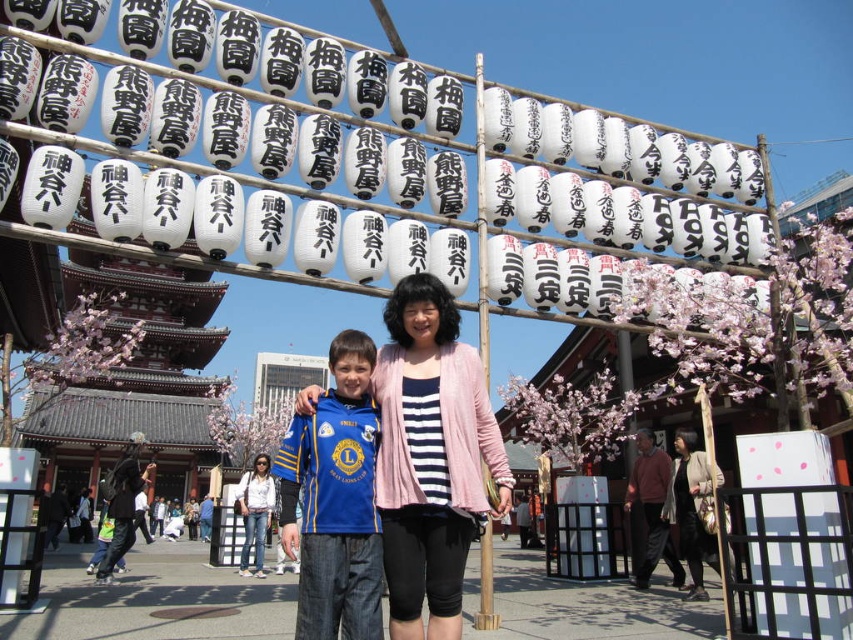
You are a photographer at the festival and want to ensure both jackets are visible in your photo. Since the matte black jacket at center and the denim jacket at lower center are positioned in a way that might block each other, which jacket should you focus on to capture both without one covering the other?

The matte black jacket at center is above the denim jacket at lower center. To capture both without one covering the other, focus on the denim jacket at lower center first, then adjust the angle slightly to include the matte black jacket at center above it.

You are a photographer at the festival and want to capture a photo of the blue jersey at center and the denim jacket at lower center. Which object should you focus on first if you need to adjust the focus based on their heights?

The blue jersey at center is taller than the denim jacket at lower center, so you should focus on the blue jersey at center first since it is taller and might require more precise focus due to its height.

You are a photographer at the festival and want to ensure both the matte black jacket at center and the denim jacket at lower center are clearly visible in your photo. Which jacket should you focus on first to ensure the smaller one isn

The matte black jacket at center is smaller than the denim jacket at lower center. To ensure both are clearly visible, focus on the smaller matte black jacket at center first to capture its details before adjusting for the larger denim jacket at lower center.